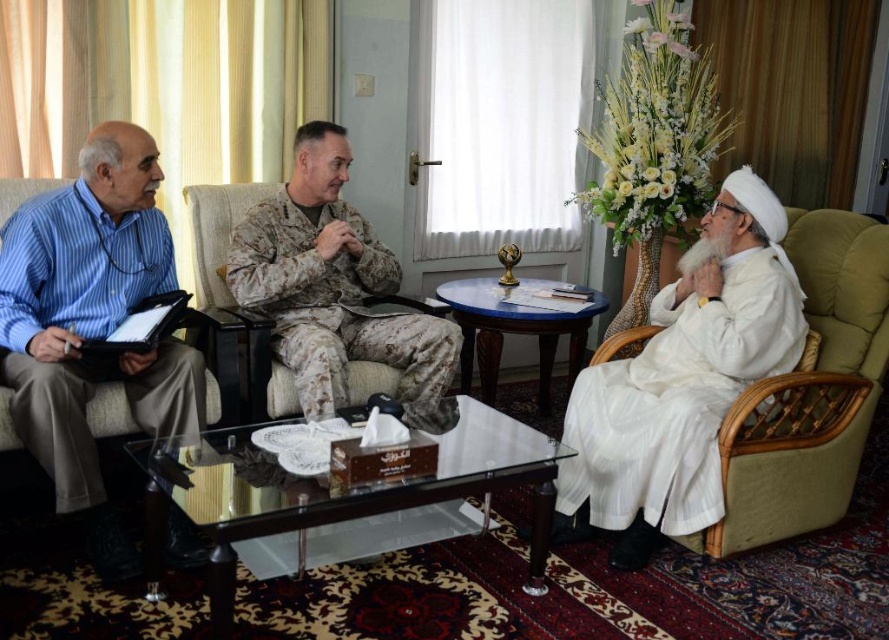
Looking at this image, in the formal meeting scene, there is a blue striped shirt at left and a white silk robe at right. Which of these two items is positioned higher in the image?

The blue striped shirt at left is much taller as white silk robe at right, so the blue striped shirt at left is positioned higher.

You are a photographer who needs to capture a group photo of the blue striped shirt at left and the white silk robe at right. The camera you are using has a maximum focus range of 1.6 meters. Can you take a photo of both subjects without moving either of them?

The blue striped shirt at left and white silk robe at right are 1.71 meters apart, which exceeds the camera maximum focus range of 1.6 meters. You need to move them closer to ensure both are in focus.

You are an interior designer observing the formal meeting scene. You need to place a decorative vase between the white silk robe at right and the glass coffee table. Based on their positions, can you determine if the vase will fit horizontally between them?

The white silk robe at right is located at point (x=677, y=400). Since the exact position of the glass coffee table isn not provided in the Objects Description, I cannot accurately determine if the vase will fit horizontally between them.